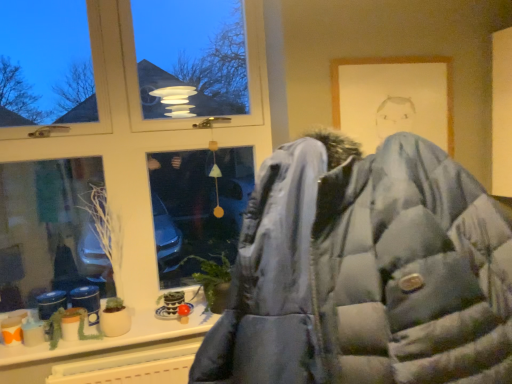
Question: From the image's perspective, is yellow plastic radiator at lower center below white matte plant at lower left, the 1th plant positioned from the top?

Choices:
 (A) no
 (B) yes

Answer: (B)

Question: Does yellow plastic radiator at lower center have a greater height compared to white matte plant at lower left, the 2th plant ordered from the bottom?

Choices:
 (A) yes
 (B) no

Answer: (B)

Question: Does yellow plastic radiator at lower center turn towards white matte plant at lower left, the 2th plant ordered from the bottom?

Choices:
 (A) yes
 (B) no

Answer: (B)

Question: Are yellow plastic radiator at lower center and white matte plant at lower left, the 2th plant ordered from the bottom, located far from each other?

Choices:
 (A) no
 (B) yes

Answer: (A)

Question: Considering the relative sizes of yellow plastic radiator at lower center and white matte plant at lower left, the 2th plant ordered from the bottom, in the image provided, is yellow plastic radiator at lower center wider than white matte plant at lower left, the 2th plant ordered from the bottom,?

Choices:
 (A) yes
 (B) no

Answer: (B)

Question: Is matte white window at center spatially inside white matte plant at lower left, the 2th plant ordered from the bottom, or outside of it?

Choices:
 (A) outside
 (B) inside

Answer: (A)

Question: Visually, is matte white window at center positioned to the left or to the right of white matte plant at lower left, the 2th plant ordered from the bottom?

Choices:
 (A) right
 (B) left

Answer: (A)

Question: Is point 123,11 positioned closer to the camera than point 99,210?

Choices:
 (A) farther
 (B) closer

Answer: (B)

Question: From the image's perspective, is matte white window at center located above or below white matte plant at lower left, the 2th plant ordered from the bottom?

Choices:
 (A) above
 (B) below

Answer: (A)

Question: From a real-world perspective, is yellow plastic radiator at lower center positioned above or below white matte plant at lower left, the 2th plant ordered from the bottom?

Choices:
 (A) above
 (B) below

Answer: (B)

Question: Is point (137, 370) closer or farther from the camera than point (102, 215)?

Choices:
 (A) closer
 (B) farther

Answer: (A)

Question: In terms of height, does yellow plastic radiator at lower center look taller or shorter compared to white matte plant at lower left, the 2th plant ordered from the bottom?

Choices:
 (A) short
 (B) tall

Answer: (A)

Question: Would you say yellow plastic radiator at lower center is to the left or to the right of white matte plant at lower left, the 1th plant positioned from the top, in the picture?

Choices:
 (A) right
 (B) left

Answer: (A)

Question: Is green matte plant at lower left, which appears as the 1th plant when ordered from the bottom, spatially inside white matte plant at lower left, the 2th plant ordered from the bottom, or outside of it?

Choices:
 (A) outside
 (B) inside

Answer: (A)

Question: Looking at their shapes, would you say green matte plant at lower left, which appears as the 1th plant when ordered from the bottom, is wider or thinner than white matte plant at lower left, the 1th plant positioned from the top?

Choices:
 (A) wide
 (B) thin

Answer: (B)